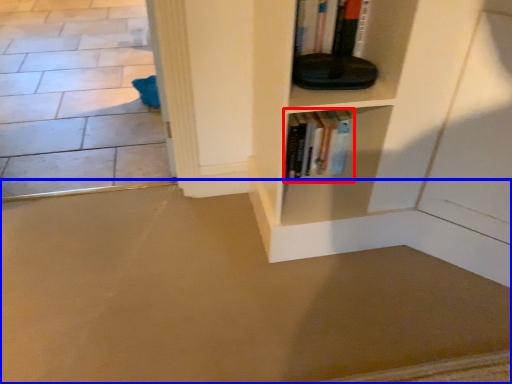
Question: Which object appears closest to the camera in this image, book (highlighted by a red box) or concrete (highlighted by a blue box)?

Choices:
 (A) book
 (B) concrete

Answer: (B)